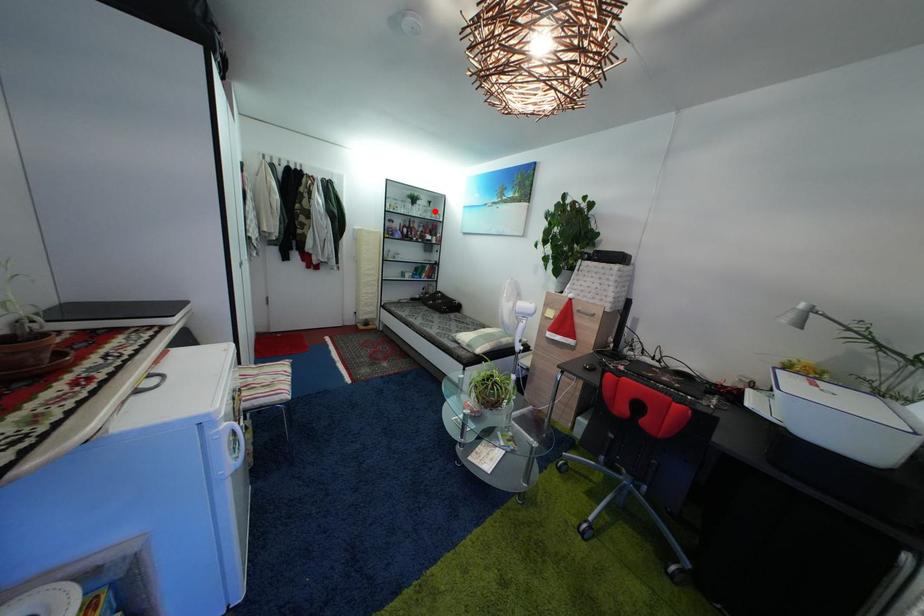
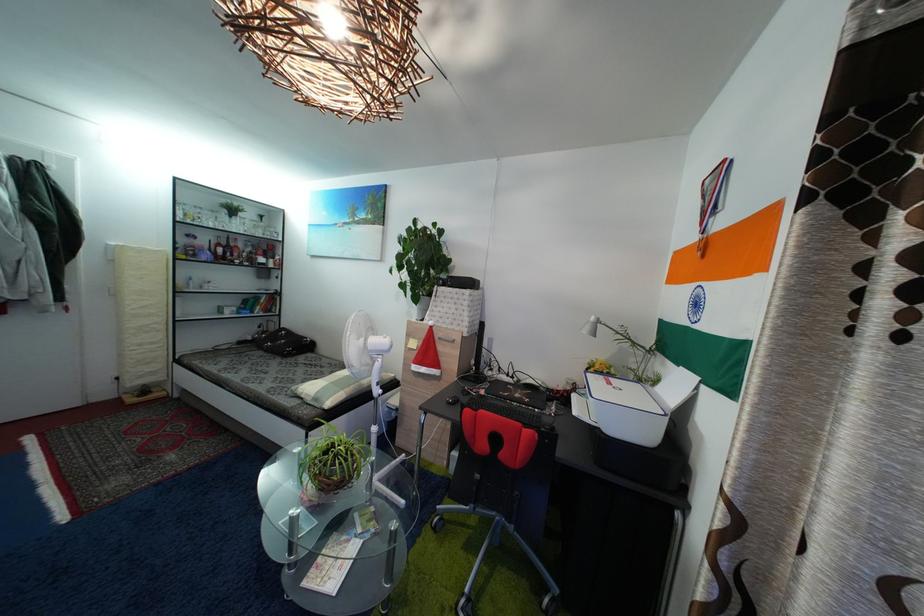
In the second image, find the point that corresponds to the highlighted location in the first image.

(264, 225)